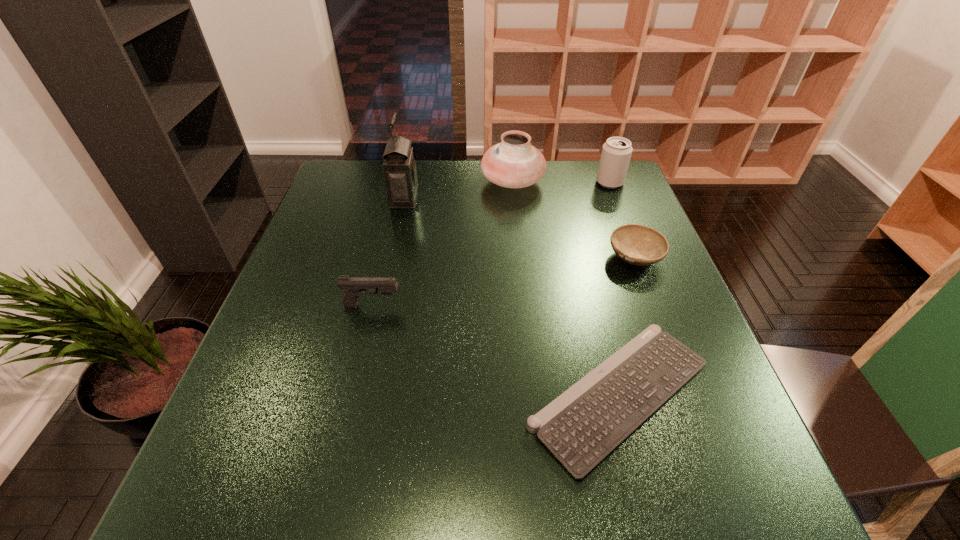
In the image, there is a desktop. In order to click on free space at the far right corner in this screenshot , I will do [593, 184].

The height and width of the screenshot is (540, 960). Identify the location of empty space between the tallest object and the third shortest object. (388, 252).

Where is `free point between the pottery and the tallest object`? The height and width of the screenshot is (540, 960). free point between the pottery and the tallest object is located at coordinates (458, 190).

In order to click on free space that is in between the fourth tallest object and the can in this screenshot , I will do `click(491, 244)`.

Where is `vacant area between the third shortest object and the can`? This screenshot has height=540, width=960. vacant area between the third shortest object and the can is located at coordinates (491, 244).

The width and height of the screenshot is (960, 540). Find the location of `vacant area that lies between the can and the tallest object`. vacant area that lies between the can and the tallest object is located at coordinates (507, 191).

This screenshot has width=960, height=540. I want to click on free point between the can and the pottery, so click(x=562, y=182).

You are a GUI agent. You are given a task and a screenshot of the screen. Output one action in this format:
    pyautogui.click(x=<x>, y=<y>)
    Task: Click on the vacant point located between the can and the third shortest object
    
    Given the screenshot: What is the action you would take?
    pyautogui.click(x=491, y=244)

Identify the location of unoccupied position between the bowl and the second nearest object. (504, 281).

Find the location of a particular element. The height and width of the screenshot is (540, 960). free point between the tallest object and the computer keyboard is located at coordinates (512, 297).